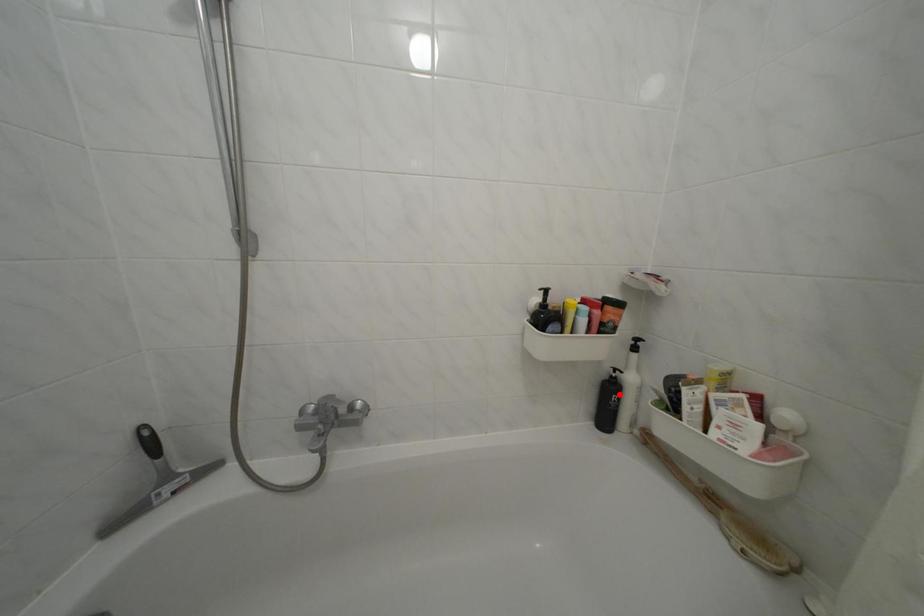
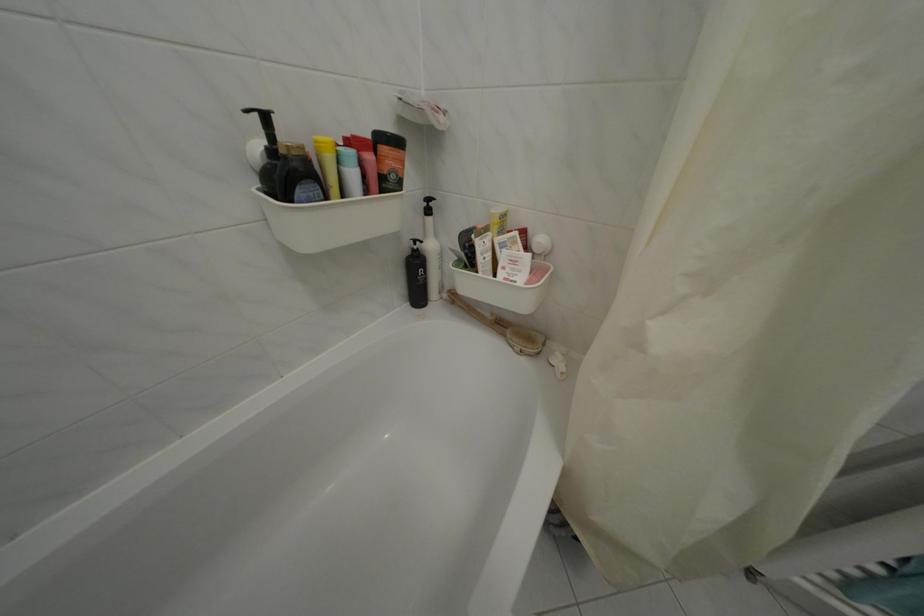
Question: A red point is marked in image1. In image2, is the corresponding 3D point closer to the camera or farther? Reply with the corresponding letter.

Choices:
 (A) The corresponding 3D point is closer.
 (B) The corresponding 3D point is farther.

Answer: (A)